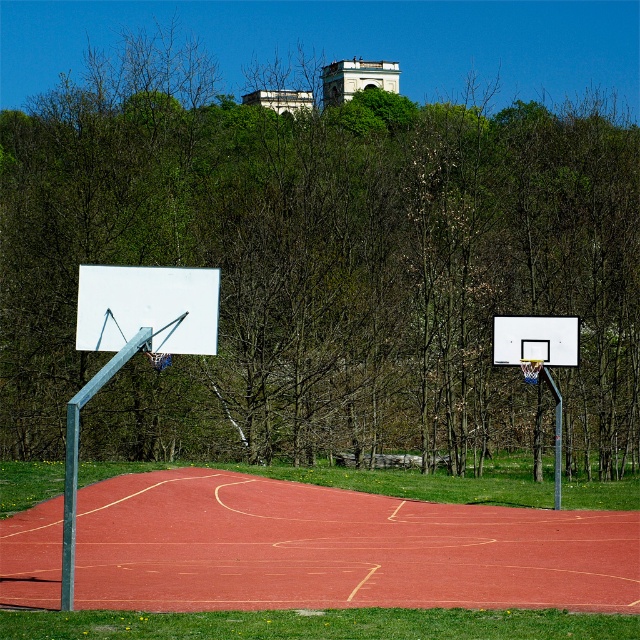
You are standing at the center of the basketball court and see a point marked at coordinates (320, 262). Based on the scene description, what object is located at that point?

The point at coordinates (320, 262) is located on the brown leafless tree at center.

You are standing at the origin point of the basketball court image. The court is laid out on a coordinate system where the bottom left corner is at coordinates 0,0 and the top right corner is at 1,1. You want to place a new basketball hoop exactly where the brown leafless tree at center is located. Is this possible? Please explain based on the coordinates provided.

The brown leafless tree at center is located at coordinates [320,262]. Since basketball hoops are typically placed at the endpoints of the court along the baseline, which would be near the corners of the coordinate system, placing a hoop at [320,262] would be in the center of the court, which is not a standard location for a basketball hoop. Therefore, it is not possible to place a basketball hoop there.